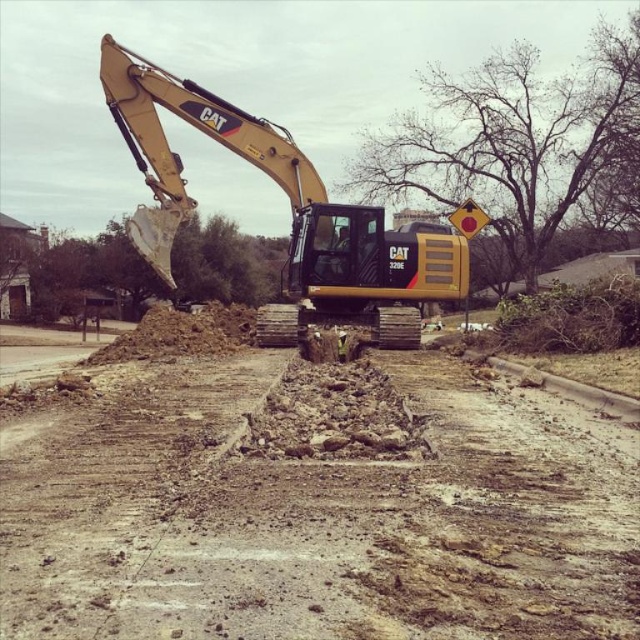
Locate an element on the screen. This screenshot has height=640, width=640. brown gravel dirt track at center is located at coordinates (316, 509).

Which of these two, brown gravel dirt track at center or yellow metallic excavator at center, stands taller?

Result: Standing taller between the two is yellow metallic excavator at center.

Between point (221, 435) and point (179, 208), which one is positioned behind?

Point (179, 208)

Identify the location of brown gravel dirt track at center. (316, 509).